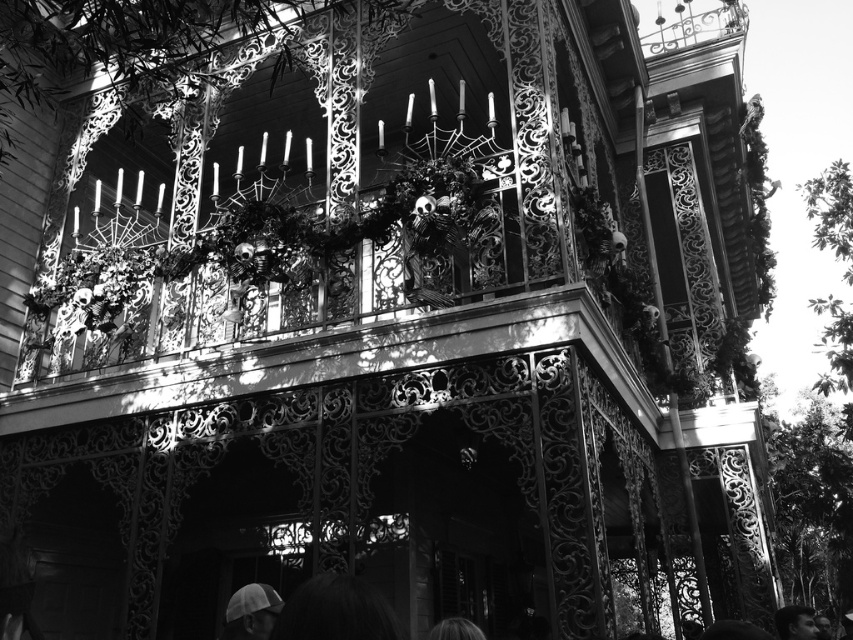
Can you confirm if smooth skin face at lower center is taller than blonde hair at lower center?

Indeed, smooth skin face at lower center has a greater height compared to blonde hair at lower center.

Who is more forward, (x=802, y=637) or (x=454, y=620)?

Point (x=454, y=620) is in front.

Identify the location of smooth skin face at lower center. (795, 621).

Between matte white cap at lower left and smooth skin face at lower center, which one has more height?

smooth skin face at lower center is taller.

Does matte white cap at lower left have a lesser width compared to smooth skin face at lower center?

Correct, matte white cap at lower left's width is less than smooth skin face at lower center's.

Between point (236, 609) and point (801, 627), which one is positioned behind?

The point (801, 627) is behind.

At what (x,y) coordinates should I click in order to perform the action: click on matte white cap at lower left. Please return your answer as a coordinate pair (x, y). Looking at the image, I should click on (251, 612).

From the picture: Who is higher up, matte white cap at lower left or blonde hair at lower center?

blonde hair at lower center is higher up.

Between point (256, 611) and point (444, 625), which one is positioned behind?

The point (256, 611) is more distant.

What do you see at coordinates (251, 612) in the screenshot?
I see `matte white cap at lower left` at bounding box center [251, 612].

Image resolution: width=853 pixels, height=640 pixels. Find the location of `matte white cap at lower left`. matte white cap at lower left is located at coordinates (251, 612).